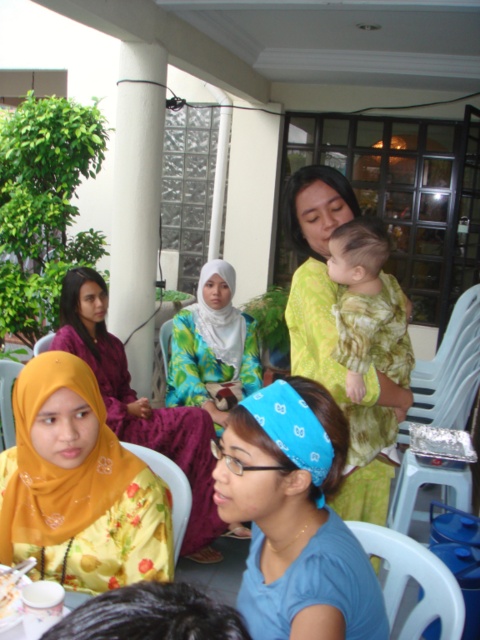
You are attending a cultural event and notice two items of clothing in the scene. The first is the yellow floral dress at lower left, and the second is the floral fabric hijab at center. From your perspective, which item is positioned lower in the image?

The yellow floral dress at lower left is positioned lower in the image than the floral fabric hijab at center.